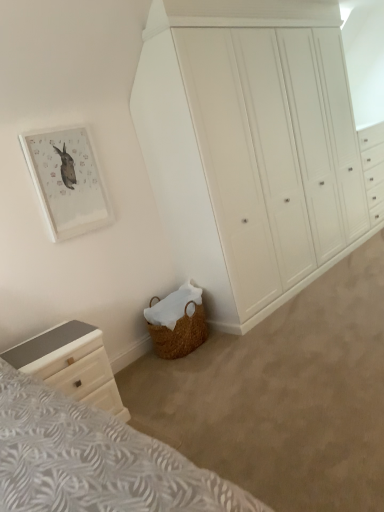
The width and height of the screenshot is (384, 512). I want to click on white painted wood wardrobe at center, which ranks as the 2th chest of drawers in bottom-to-top order, so click(x=250, y=147).

The height and width of the screenshot is (512, 384). Describe the element at coordinates (71, 364) in the screenshot. I see `white glossy chest of drawers at lower left, positioned as the 1th chest of drawers in bottom-to-top order` at that location.

The height and width of the screenshot is (512, 384). Describe the element at coordinates (68, 181) in the screenshot. I see `matte white picture frame at upper left` at that location.

Locate an element on the screen. white painted wood wardrobe at center, which ranks as the 2th chest of drawers in left-to-right order is located at coordinates (250, 147).

Can you confirm if white glossy chest of drawers at lower left, the 2th chest of drawers from the top, is smaller than matte white picture frame at upper left?

Incorrect, white glossy chest of drawers at lower left, the 2th chest of drawers from the top, is not smaller in size than matte white picture frame at upper left.

Considering the relative sizes of white glossy chest of drawers at lower left, which ranks as the first chest of drawers in left-to-right order, and matte white picture frame at upper left in the image provided, is white glossy chest of drawers at lower left, which ranks as the first chest of drawers in left-to-right order, taller than matte white picture frame at upper left?

In fact, white glossy chest of drawers at lower left, which ranks as the first chest of drawers in left-to-right order, may be shorter than matte white picture frame at upper left.

Based on their positions, is white glossy chest of drawers at lower left, which is the 1th chest of drawers from front to back, located to the left or right of matte white picture frame at upper left?

Based on their positions, white glossy chest of drawers at lower left, which is the 1th chest of drawers from front to back, is located to the right of matte white picture frame at upper left.

From the matte white picture frame at upper left, count 1st chest of drawers to the right and point to it. Please provide its 2D coordinates.

[(71, 364)]

Is matte white picture frame at upper left wider than white painted wood wardrobe at center, placed as the second chest of drawers when sorted from front to back?

No, matte white picture frame at upper left is not wider than white painted wood wardrobe at center, placed as the second chest of drawers when sorted from front to back.

Considering the positions of points (52, 229) and (354, 140), is point (52, 229) farther from camera compared to point (354, 140)?

No, (52, 229) is in front of (354, 140).

Would you say matte white picture frame at upper left contains white painted wood wardrobe at center, placed as the second chest of drawers when sorted from front to back?

No, white painted wood wardrobe at center, placed as the second chest of drawers when sorted from front to back, is not a part of matte white picture frame at upper left.

Based on the photo, considering their positions, is matte white picture frame at upper left located in front of or behind white painted wood wardrobe at center, which appears as the 1th chest of drawers when viewed from the back?

Clearly, matte white picture frame at upper left is behind white painted wood wardrobe at center, which appears as the 1th chest of drawers when viewed from the back.

From the image's perspective, between white painted wood wardrobe at center, which ranks as the 2th chest of drawers in left-to-right order, and matte white picture frame at upper left, who is located below?

matte white picture frame at upper left, from the image's perspective.

In terms of height, does white painted wood wardrobe at center, which appears as the 1th chest of drawers when viewed from the back, look taller or shorter compared to matte white picture frame at upper left?

white painted wood wardrobe at center, which appears as the 1th chest of drawers when viewed from the back, is taller than matte white picture frame at upper left.

Considering the positions of point (291, 9) and point (54, 196), is point (291, 9) closer or farther from the camera than point (54, 196)?

Point (291, 9) appears to be farther away from the viewer than point (54, 196).

Measure the distance from matte white picture frame at upper left to white glossy chest of drawers at lower left, positioned as the 1th chest of drawers in bottom-to-top order.

matte white picture frame at upper left and white glossy chest of drawers at lower left, positioned as the 1th chest of drawers in bottom-to-top order, are 36.58 inches apart from each other.

Is matte white picture frame at upper left not close to white glossy chest of drawers at lower left, the 2th chest of drawers from the top?

Actually, matte white picture frame at upper left and white glossy chest of drawers at lower left, the 2th chest of drawers from the top, are a little close together.

Which is in front, matte white picture frame at upper left or white glossy chest of drawers at lower left, positioned as the 1th chest of drawers in bottom-to-top order?

white glossy chest of drawers at lower left, positioned as the 1th chest of drawers in bottom-to-top order, is more forward.

Who is bigger, matte white picture frame at upper left or white glossy chest of drawers at lower left, positioned as the 1th chest of drawers in bottom-to-top order?

With larger size is white glossy chest of drawers at lower left, positioned as the 1th chest of drawers in bottom-to-top order.

Does white painted wood wardrobe at center, which ranks as the 2th chest of drawers in bottom-to-top order, contain white glossy chest of drawers at lower left, the 2th chest of drawers from the right?

No, white glossy chest of drawers at lower left, the 2th chest of drawers from the right, is not surrounded by white painted wood wardrobe at center, which ranks as the 2th chest of drawers in bottom-to-top order.

In the image, is white painted wood wardrobe at center, the first chest of drawers viewed from the right, positioned in front of or behind white glossy chest of drawers at lower left, the 2th chest of drawers from the top?

In the image, white painted wood wardrobe at center, the first chest of drawers viewed from the right, appears behind white glossy chest of drawers at lower left, the 2th chest of drawers from the top.

Can you confirm if white painted wood wardrobe at center, which is counted as the 1th chest of drawers, starting from the top, is positioned to the right of white glossy chest of drawers at lower left, arranged as the 2th chest of drawers when viewed from the back?

Yes, white painted wood wardrobe at center, which is counted as the 1th chest of drawers, starting from the top, is to the right of white glossy chest of drawers at lower left, arranged as the 2th chest of drawers when viewed from the back.

In order to click on chest of drawers on the right side of white glossy chest of drawers at lower left, the 2th chest of drawers from the top in this screenshot , I will do `click(250, 147)`.

Would you say white painted wood wardrobe at center, which ranks as the 2th chest of drawers in left-to-right order, is part of white glossy chest of drawers at lower left, which ranks as the first chest of drawers in left-to-right order,'s contents?

No, white painted wood wardrobe at center, which ranks as the 2th chest of drawers in left-to-right order, is located outside of white glossy chest of drawers at lower left, which ranks as the first chest of drawers in left-to-right order.

Does white glossy chest of drawers at lower left, positioned as the 1th chest of drawers in bottom-to-top order, have a smaller size compared to white painted wood wardrobe at center, which is counted as the 1th chest of drawers, starting from the top?

Yes, white glossy chest of drawers at lower left, positioned as the 1th chest of drawers in bottom-to-top order, is smaller than white painted wood wardrobe at center, which is counted as the 1th chest of drawers, starting from the top.

In terms of width, does white glossy chest of drawers at lower left, positioned as the 1th chest of drawers in bottom-to-top order, look wider or thinner when compared to white painted wood wardrobe at center, which appears as the 1th chest of drawers when viewed from the back?

In the image, white glossy chest of drawers at lower left, positioned as the 1th chest of drawers in bottom-to-top order, appears to be more narrow than white painted wood wardrobe at center, which appears as the 1th chest of drawers when viewed from the back.

From a real-world perspective, is white glossy chest of drawers at lower left, the 2th chest of drawers from the right, physically below white painted wood wardrobe at center, which appears as the 1th chest of drawers when viewed from the back?

Yes, from a real-world perspective, white glossy chest of drawers at lower left, the 2th chest of drawers from the right, is under white painted wood wardrobe at center, which appears as the 1th chest of drawers when viewed from the back.

The height and width of the screenshot is (512, 384). Identify the location of picture frame above the white glossy chest of drawers at lower left, the 2th chest of drawers from the right (from a real-world perspective). (68, 181).

In the image, there is a white painted wood wardrobe at center, which appears as the 1th chest of drawers when viewed from the back. Where is `picture frame below it (from the image's perspective)`? This screenshot has width=384, height=512. picture frame below it (from the image's perspective) is located at coordinates (68, 181).

Looking at the image, which one is located further to matte white picture frame at upper left, white painted wood wardrobe at center, which ranks as the 2th chest of drawers in bottom-to-top order, or white glossy chest of drawers at lower left, the 2th chest of drawers from the top?

white painted wood wardrobe at center, which ranks as the 2th chest of drawers in bottom-to-top order, lies further to matte white picture frame at upper left than the other object.

Estimate the real-world distances between objects in this image. Which object is further from white glossy chest of drawers at lower left, which ranks as the first chest of drawers in left-to-right order, matte white picture frame at upper left or white painted wood wardrobe at center, which is counted as the 1th chest of drawers, starting from the top?

white painted wood wardrobe at center, which is counted as the 1th chest of drawers, starting from the top, is positioned further to the anchor white glossy chest of drawers at lower left, which ranks as the first chest of drawers in left-to-right order.

Based on their spatial positions, is white painted wood wardrobe at center, which is counted as the 1th chest of drawers, starting from the top, or matte white picture frame at upper left closer to white glossy chest of drawers at lower left, positioned as the 1th chest of drawers in bottom-to-top order?

Among the two, matte white picture frame at upper left is located nearer to white glossy chest of drawers at lower left, positioned as the 1th chest of drawers in bottom-to-top order.

Based on their spatial positions, is white glossy chest of drawers at lower left, the 2th chest of drawers from the top, or matte white picture frame at upper left further from white painted wood wardrobe at center, which is counted as the 1th chest of drawers, starting from the top?

white glossy chest of drawers at lower left, the 2th chest of drawers from the top, is positioned further to the anchor white painted wood wardrobe at center, which is counted as the 1th chest of drawers, starting from the top.

Based on the photo, estimate the real-world distances between objects in this image. Which object is closer to white painted wood wardrobe at center, placed as the second chest of drawers when sorted from front to back, matte white picture frame at upper left or white glossy chest of drawers at lower left, positioned as the 1th chest of drawers in bottom-to-top order?

The object closer to white painted wood wardrobe at center, placed as the second chest of drawers when sorted from front to back, is matte white picture frame at upper left.

When comparing their distances from matte white picture frame at upper left, does white glossy chest of drawers at lower left, the 2th chest of drawers from the top, or white painted wood wardrobe at center, the first chest of drawers viewed from the right, seem closer?

white glossy chest of drawers at lower left, the 2th chest of drawers from the top.

Locate an element on the screen. The image size is (384, 512). picture frame between white painted wood wardrobe at center, placed as the second chest of drawers when sorted from front to back, and white glossy chest of drawers at lower left, arranged as the 2th chest of drawers when viewed from the back, vertically is located at coordinates (68, 181).